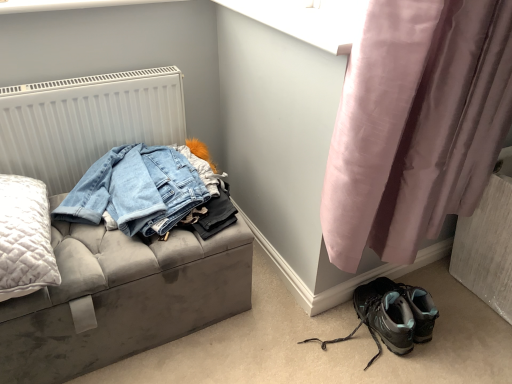
The height and width of the screenshot is (384, 512). I want to click on vacant space situated on the left part of matte black hiking boots at lower right, so click(x=267, y=335).